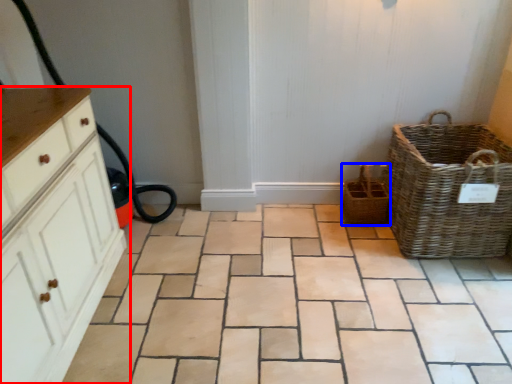
Question: Which of the following is the closest to the observer, chest of drawers (highlighted by a red box) or basket (highlighted by a blue box)?

Choices:
 (A) chest of drawers
 (B) basket

Answer: (A)